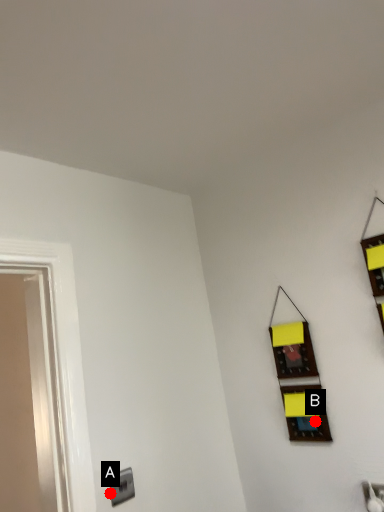
Question: Two points are circled on the image, labeled by A and B beside each circle. Which point is further to the camera?

Choices:
 (A) A is further
 (B) B is further

Answer: (B)